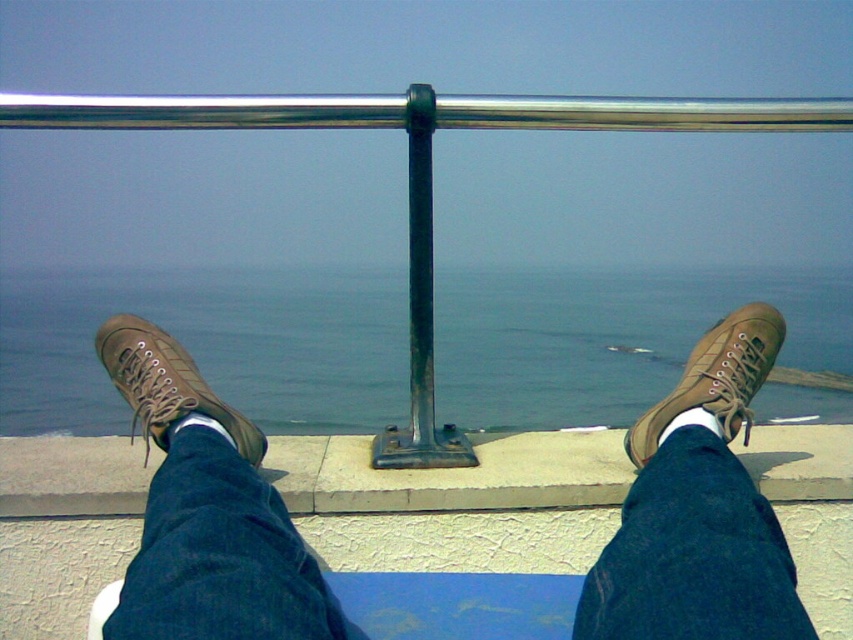
Question: Can you confirm if smooth concrete ledge at center is positioned to the left of brown suede shoe at center?

Choices:
 (A) yes
 (B) no

Answer: (A)

Question: Based on their relative distances, which object is nearer to the metallic pole at center?

Choices:
 (A) brown suede shoe at lower left
 (B) brown suede shoe at center
 (C) brown leather shoes at center

Answer: (A)

Question: Does blue water at center appear over metallic pole at center?

Choices:
 (A) no
 (B) yes

Answer: (A)

Question: Which object is the closest to the brown suede shoe at center?

Choices:
 (A) brown suede shoe at lower left
 (B) smooth concrete ledge at center
 (C) polished metal rail at upper center
 (D) blue water at center

Answer: (B)

Question: Where is smooth concrete ledge at center located in relation to brown suede shoe at center in the image?

Choices:
 (A) right
 (B) left

Answer: (B)

Question: Which point is farther to the camera?

Choices:
 (A) (735, 564)
 (B) (219, 122)

Answer: (B)